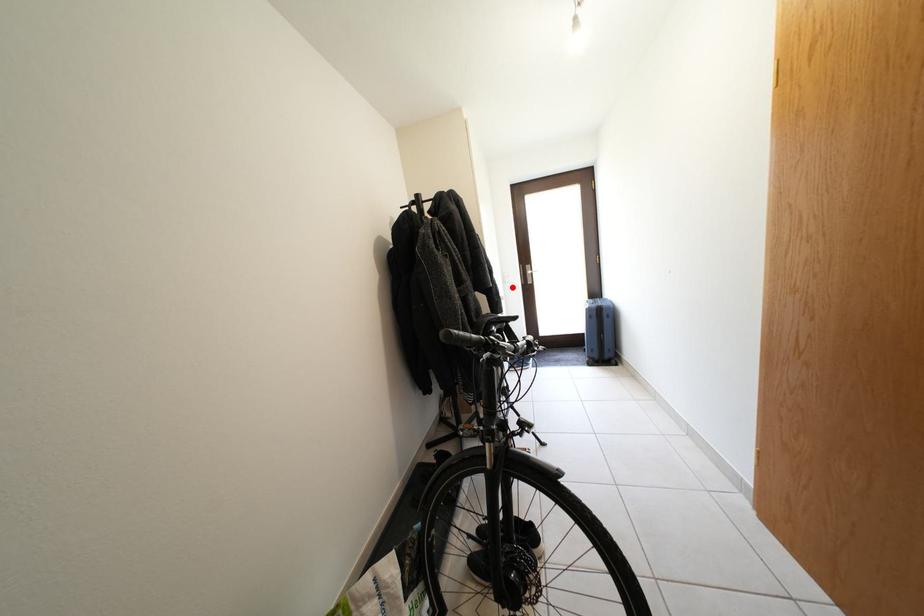
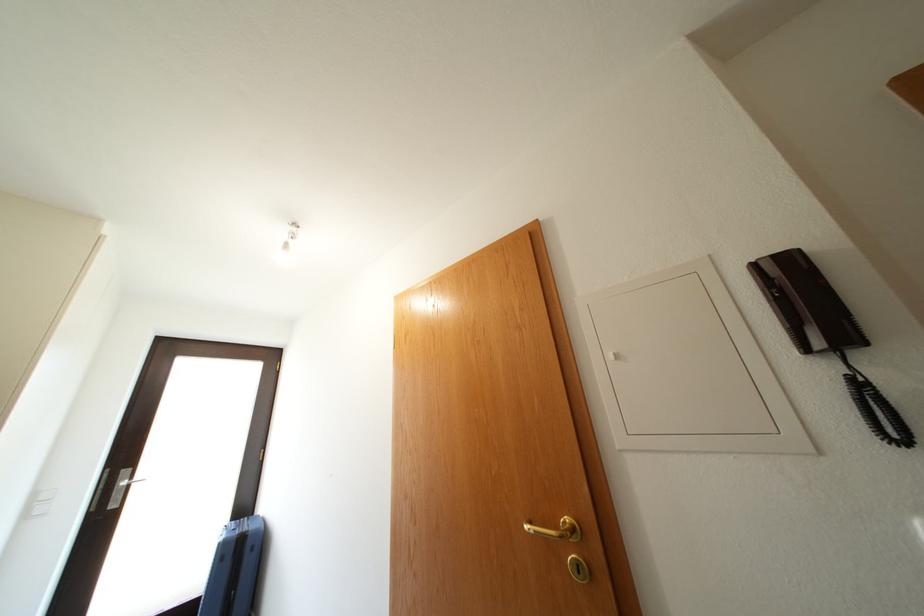
Find the pixel in the second image that matches the highlighted location in the first image.

(33, 522)